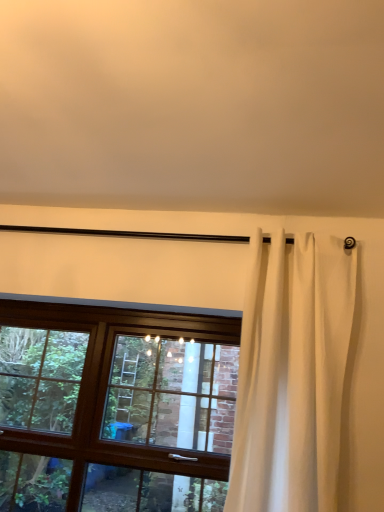
This screenshot has width=384, height=512. What do you see at coordinates (292, 375) in the screenshot? I see `white sheer curtain at right` at bounding box center [292, 375].

The width and height of the screenshot is (384, 512). Identify the location of white sheer curtain at right. (292, 375).

The image size is (384, 512). I want to click on brown wooden window at center, so click(115, 408).

The width and height of the screenshot is (384, 512). Describe the element at coordinates (115, 408) in the screenshot. I see `brown wooden window at center` at that location.

Identify the location of white sheer curtain at right. The height and width of the screenshot is (512, 384). (292, 375).

Which is more to the right, white sheer curtain at right or brown wooden window at center?

Positioned to the right is white sheer curtain at right.

Which object is more forward, white sheer curtain at right or brown wooden window at center?

Positioned in front is white sheer curtain at right.

Considering the positions of point (277, 361) and point (34, 463), is point (277, 361) closer or farther from the camera than point (34, 463)?

Clearly, point (277, 361) is closer to the camera than point (34, 463).

From the image's perspective, does white sheer curtain at right appear higher than brown wooden window at center?

Yes.

From a real-world perspective, is white sheer curtain at right below brown wooden window at center?

No, from a real-world perspective, white sheer curtain at right is not below brown wooden window at center.

Which of these two, white sheer curtain at right or brown wooden window at center, is wider?

white sheer curtain at right.

Is white sheer curtain at right taller or shorter than brown wooden window at center?

In the image, white sheer curtain at right appears to be taller than brown wooden window at center.

Based on the photo, is white sheer curtain at right bigger or smaller than brown wooden window at center?

Clearly, white sheer curtain at right is smaller in size than brown wooden window at center.

Looking at this image, is white sheer curtain at right positioned beyond the bounds of brown wooden window at center?

Yes, white sheer curtain at right is outside of brown wooden window at center.

Is white sheer curtain at right far from brown wooden window at center?

They are positioned close to each other.

Is white sheer curtain at right looking in the opposite direction of brown wooden window at center?

white sheer curtain at right does not have its back to brown wooden window at center.

Identify the location of curtain in front of the brown wooden window at center. The image size is (384, 512). (292, 375).

Can you confirm if brown wooden window at center is positioned to the right of white sheer curtain at right?

No.

Consider the image. Which object is more forward, brown wooden window at center or white sheer curtain at right?

white sheer curtain at right is more forward.

Is point (167, 410) positioned in front of point (253, 371)?

No.

From the image's perspective, relative to white sheer curtain at right, is brown wooden window at center above or below?

brown wooden window at center is below white sheer curtain at right.

From a real-world perspective, is brown wooden window at center positioned above or below white sheer curtain at right?

brown wooden window at center is below white sheer curtain at right.

Does brown wooden window at center have a greater width compared to white sheer curtain at right?

No, brown wooden window at center is not wider than white sheer curtain at right.

From the picture: Is brown wooden window at center taller than white sheer curtain at right?

In fact, brown wooden window at center may be shorter than white sheer curtain at right.

Can you confirm if brown wooden window at center is smaller than white sheer curtain at right?

Incorrect, brown wooden window at center is not smaller in size than white sheer curtain at right.

Can white sheer curtain at right be found inside brown wooden window at center?

Definitely not — white sheer curtain at right is not inside brown wooden window at center.

Is brown wooden window at center next to white sheer curtain at right?

No, brown wooden window at center is not making contact with white sheer curtain at right.

Is white sheer curtain at right at the back of brown wooden window at center?

brown wooden window at center is not turned away from white sheer curtain at right.

How far apart are brown wooden window at center and white sheer curtain at right?

69.50 centimeters.

Locate an element on the screen. This screenshot has height=512, width=384. curtain located above the brown wooden window at center (from the image's perspective) is located at coordinates (292, 375).

I want to click on curtain on the right of the brown wooden window at center, so click(x=292, y=375).

Where is `window below the white sheer curtain at right (from the image's perspective)`? This screenshot has width=384, height=512. window below the white sheer curtain at right (from the image's perspective) is located at coordinates tap(115, 408).